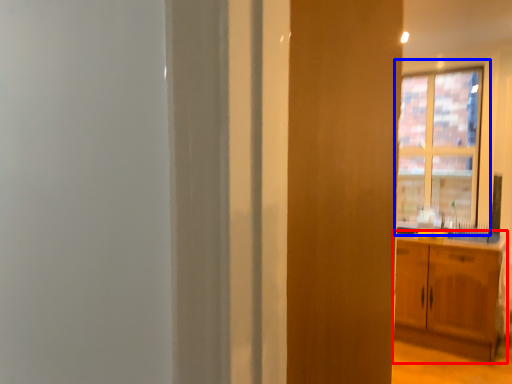
Question: Which object appears farthest to the camera in this image, cabinetry (highlighted by a red box) or window (highlighted by a blue box)?

Choices:
 (A) cabinetry
 (B) window

Answer: (B)